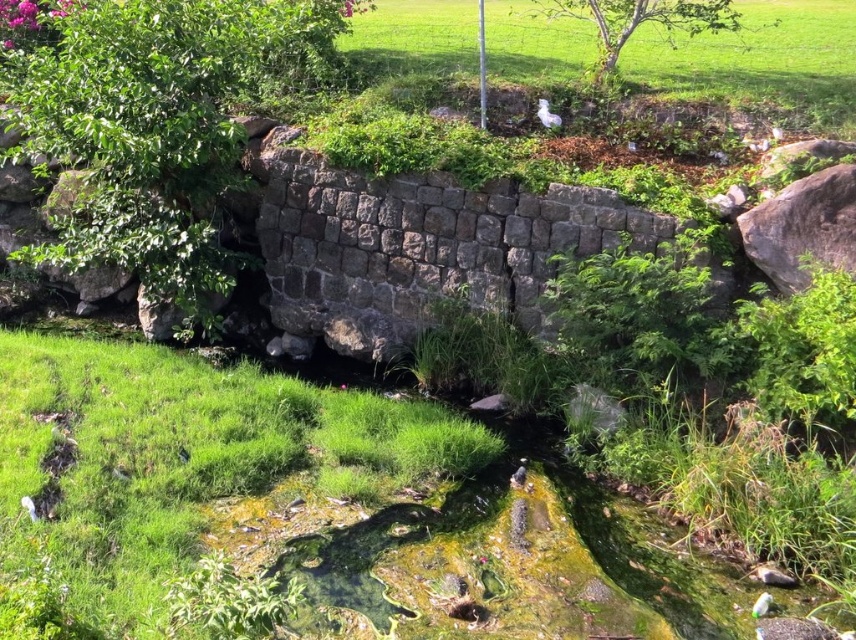
You are a photographer aiming to capture the green grass at center and the white feathered bird at upper center in a single frame. Given their relative sizes, which object will occupy more space in your photo?

The green grass at center will occupy more space in the photo since its width surpasses that of the white feathered bird at upper center.